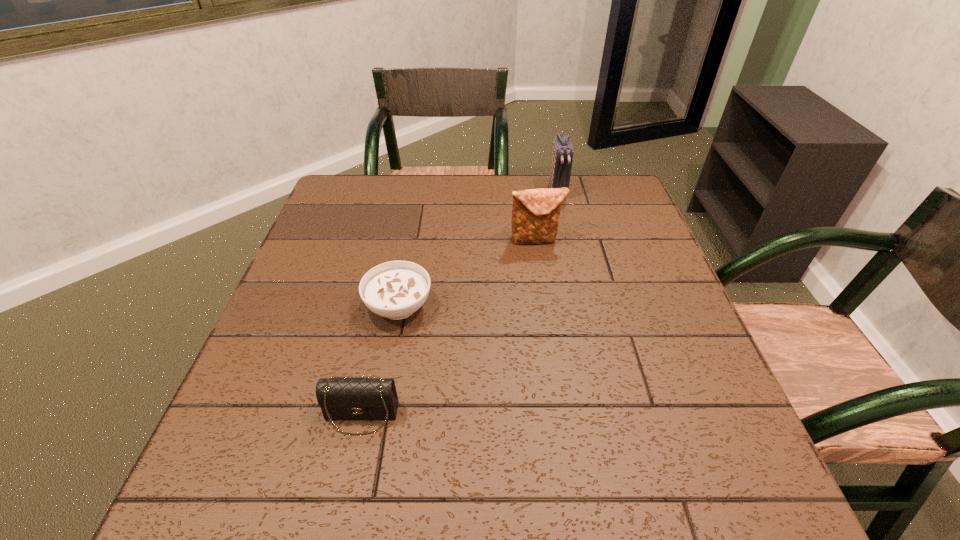
Identify the location of free point between the nearest object and the third farthest object. (380, 361).

Locate an element on the screen. The width and height of the screenshot is (960, 540). vacant point located between the leftmost clutch bag and the second farthest clutch bag is located at coordinates (448, 328).

Where is `vacant space that is in between the shortest object and the farthest object`? This screenshot has height=540, width=960. vacant space that is in between the shortest object and the farthest object is located at coordinates (478, 249).

Where is `vacant space that is in between the nearest object and the second nearest clutch bag`? The width and height of the screenshot is (960, 540). vacant space that is in between the nearest object and the second nearest clutch bag is located at coordinates (448, 328).

Find the location of a particular element. free space between the shortest object and the leftmost clutch bag is located at coordinates (380, 361).

Locate an element on the screen. This screenshot has width=960, height=540. vacant space in between the shortest object and the second nearest clutch bag is located at coordinates (468, 273).

You are a GUI agent. You are given a task and a screenshot of the screen. Output one action in this format:
    pyautogui.click(x=<x>, y=<y>)
    Task: Click on the vacant point located between the third farthest object and the second nearest clutch bag
    Image resolution: width=960 pixels, height=540 pixels.
    Given the screenshot: What is the action you would take?
    pyautogui.click(x=468, y=273)

Where is `object that is the second nearest to the nearest object`? This screenshot has height=540, width=960. object that is the second nearest to the nearest object is located at coordinates (535, 215).

Locate which object ranks second in proximity to the soup bowl. Please provide its 2D coordinates. Your answer should be formatted as a tuple, i.e. [(x, y)], where the tuple contains the x and y coordinates of a point satisfying the conditions above.

[(535, 215)]

Identify which clutch bag is located as the second nearest to the shortest object. Please provide its 2D coordinates. Your answer should be formatted as a tuple, i.e. [(x, y)], where the tuple contains the x and y coordinates of a point satisfying the conditions above.

[(535, 215)]